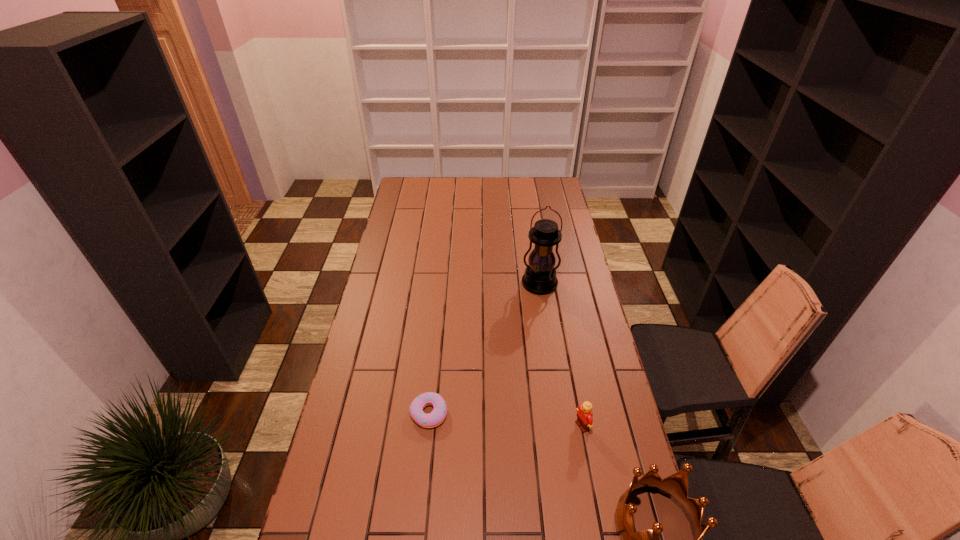
Locate an element on the screen. The image size is (960, 540). free space on the desktop that is between the shortest object and the nearest object and is positioned above the farthest object, indicating its light source is located at coordinates (530, 464).

You are a GUI agent. You are given a task and a screenshot of the screen. Output one action in this format:
    pyautogui.click(x=<x>, y=<y>)
    Task: Click on the vacant space on the desktop that is between the doughnut and the second tallest object and is positioned on the face of the third tallest object
    This screenshot has height=540, width=960.
    Given the screenshot: What is the action you would take?
    pyautogui.click(x=516, y=457)